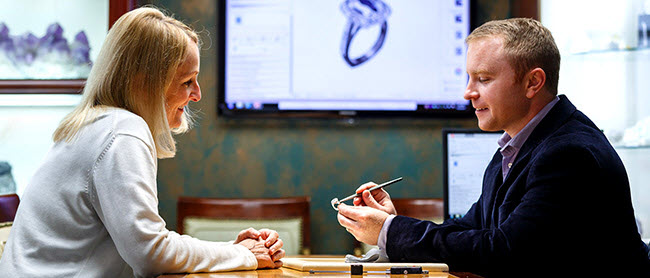
This screenshot has width=650, height=278. Identify the location of digital screen. (472, 148), (331, 44).